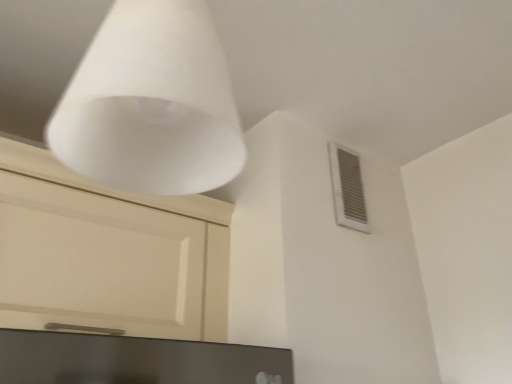
Question: Is matte black monitor at lower center wider or thinner than white plastic vent at upper right?

Choices:
 (A) wide
 (B) thin

Answer: (A)

Question: In terms of height, does matte black monitor at lower center look taller or shorter compared to white plastic vent at upper right?

Choices:
 (A) short
 (B) tall

Answer: (A)

Question: Considering the real-world distances, which object is farthest from the white matte cone at upper center?

Choices:
 (A) white plastic vent at upper right
 (B) matte black monitor at lower center

Answer: (A)

Question: Which object is the closest to the white matte cone at upper center?

Choices:
 (A) white plastic vent at upper right
 (B) matte black monitor at lower center

Answer: (B)